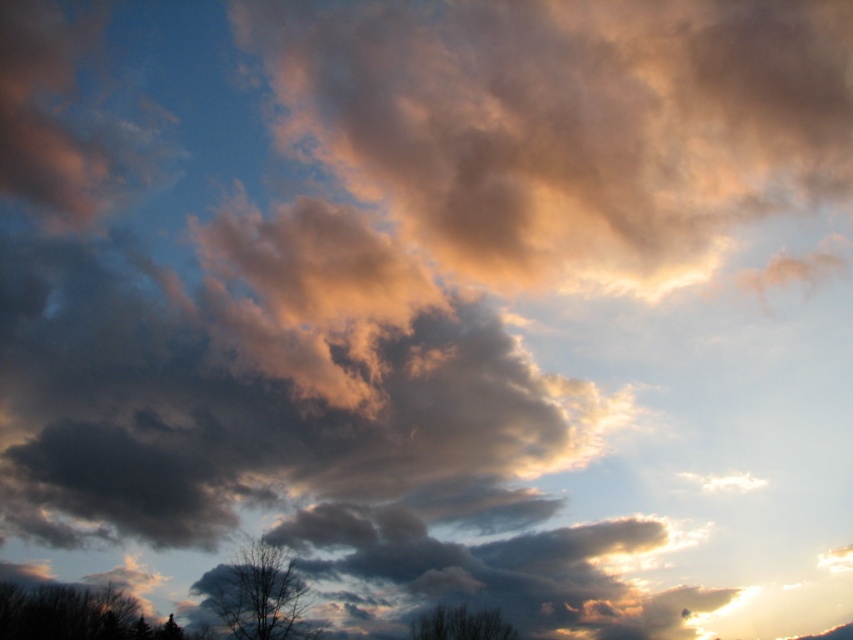
Question: Does golden textured cloud at upper center lie behind dark brown textured tree at lower left?

Choices:
 (A) yes
 (B) no

Answer: (A)

Question: Can you confirm if dark brown textured tree at lower left is thinner than silhouette bare tree at lower left?

Choices:
 (A) no
 (B) yes

Answer: (A)

Question: Which object is the closest to the golden textured cloud at upper center?

Choices:
 (A) dark brown textured tree at lower left
 (B) silhouette bare tree at lower left

Answer: (A)

Question: Which of the following is the closest to the observer?

Choices:
 (A) silhouette bare tree at lower left
 (B) dark brown textured tree at lower left

Answer: (B)

Question: Which of the following is the closest to the observer?

Choices:
 (A) golden textured cloud at upper center
 (B) silhouette bare tree at lower left
 (C) dark brown textured tree at lower left

Answer: (C)

Question: Does dark brown textured tree at lower left have a larger size compared to bare branches at lower center?

Choices:
 (A) yes
 (B) no

Answer: (B)